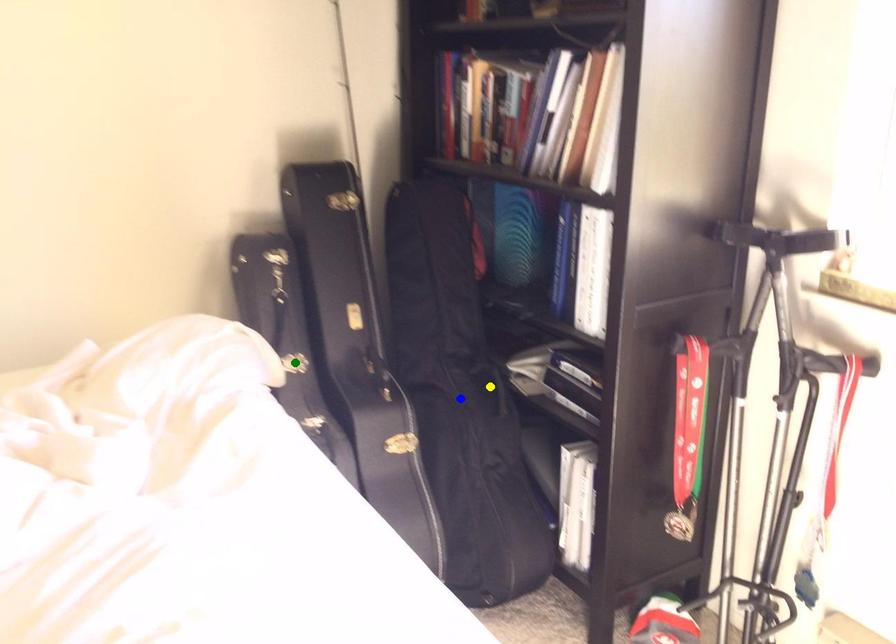
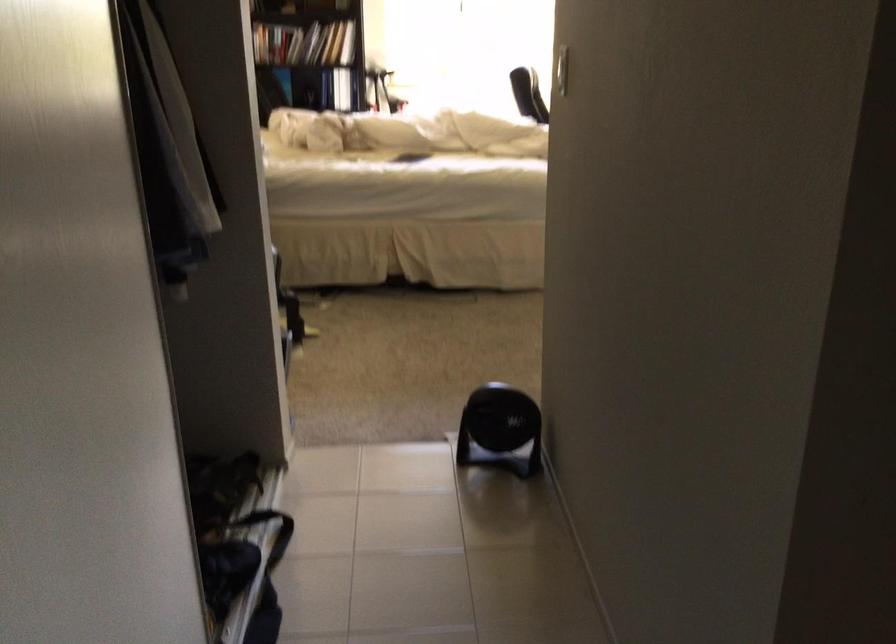
I am providing you with two images of the same scene from different viewpoints. Three points are marked in image1. Which point corresponds to a part or object that is occluded in image2?In image1, three points are marked. Which of them correspond to a part or object that is occluded in image2?Among the three points shown in image1, which one corresponds to a part or object that is no longer visible due to occlusion in image2?

blue point, green point, yellow point cannot be seen in image2.